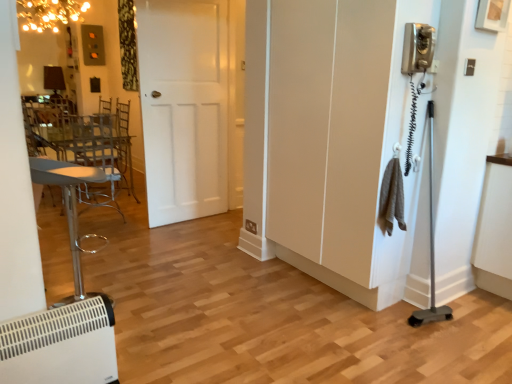
Question: Is white matte door at center not inside white plastic heater at lower left?

Choices:
 (A) no
 (B) yes

Answer: (B)

Question: From the image's perspective, is white matte door at center above white plastic heater at lower left?

Choices:
 (A) yes
 (B) no

Answer: (A)

Question: Does white matte door at center have a lesser width compared to white plastic heater at lower left?

Choices:
 (A) yes
 (B) no

Answer: (A)

Question: Considering the relative sizes of white matte door at center and white plastic heater at lower left in the image provided, is white matte door at center smaller than white plastic heater at lower left?

Choices:
 (A) no
 (B) yes

Answer: (A)

Question: From a real-world perspective, is white matte door at center beneath white plastic heater at lower left?

Choices:
 (A) yes
 (B) no

Answer: (B)

Question: In terms of height, does white matte door at center look taller or shorter compared to white plastic heater at lower left?

Choices:
 (A) short
 (B) tall

Answer: (B)

Question: Considering the positions of white matte door at center and white plastic heater at lower left in the image, is white matte door at center wider or thinner than white plastic heater at lower left?

Choices:
 (A) thin
 (B) wide

Answer: (A)

Question: Considering the relative positions of white matte door at center and white plastic heater at lower left in the image provided, is white matte door at center to the left or to the right of white plastic heater at lower left?

Choices:
 (A) left
 (B) right

Answer: (B)

Question: Does point (181, 6) appear closer or farther from the camera than point (75, 309)?

Choices:
 (A) farther
 (B) closer

Answer: (A)

Question: Is white plastic heater at lower left spatially inside white plastic heater at lower left, or outside of it?

Choices:
 (A) outside
 (B) inside

Answer: (A)

Question: Does point (51, 322) appear closer or farther from the camera than point (76, 244)?

Choices:
 (A) farther
 (B) closer

Answer: (B)

Question: Based on their sizes in the image, would you say white plastic heater at lower left is bigger or smaller than white plastic heater at lower left?

Choices:
 (A) big
 (B) small

Answer: (B)

Question: From a real-world perspective, is white plastic heater at lower left positioned above or below white plastic heater at lower left?

Choices:
 (A) above
 (B) below

Answer: (B)

Question: Relative to white matte screen door at right, is white plastic heater at lower left in front or behind?

Choices:
 (A) front
 (B) behind

Answer: (A)

Question: Is point (80, 347) positioned closer to the camera than point (348, 192)?

Choices:
 (A) farther
 (B) closer

Answer: (B)